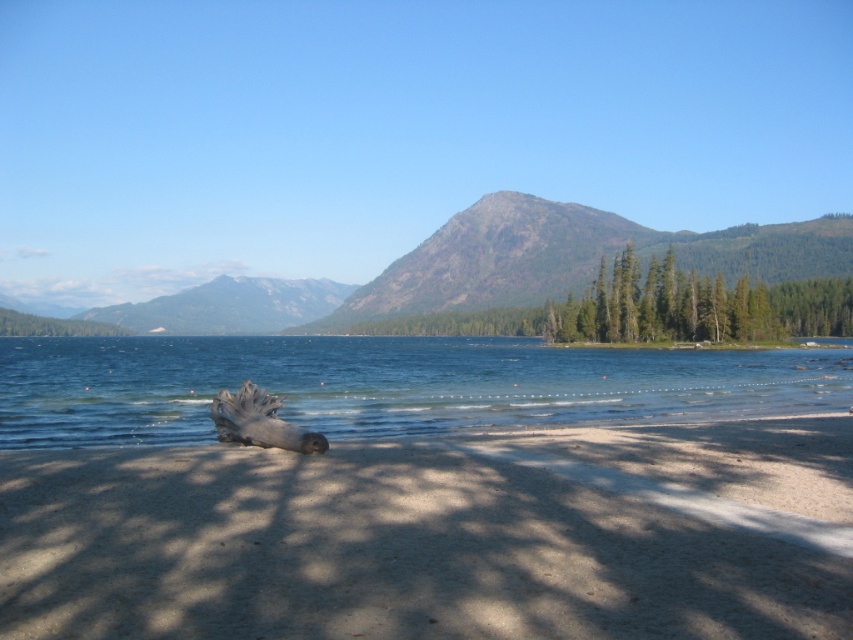
Between brown sandy beach at lower center and green textured mountain at center, which one has more height?

green textured mountain at center

Is brown sandy beach at lower center closer to camera compared to green textured mountain at center?

That is True.

Which is in front, point (795, 451) or point (252, 308)?

Positioned in front is point (795, 451).

This screenshot has width=853, height=640. Find the location of `brown sandy beach at lower center`. brown sandy beach at lower center is located at coordinates (439, 536).

Which is more to the left, green textured mountain at center or green textured trees at center?

From the viewer's perspective, green textured mountain at center appears more on the left side.

Measure the distance between green textured mountain at center and green textured trees at center.

green textured mountain at center is 89.32 feet from green textured trees at center.

The width and height of the screenshot is (853, 640). What do you see at coordinates (537, 284) in the screenshot? I see `green textured mountain at center` at bounding box center [537, 284].

Locate an element on the screen. green textured mountain at center is located at coordinates (537, 284).

Can you confirm if clear water at beach center is shorter than green textured mountain at center?

Yes.

Looking at this image, is clear water at beach center taller than green textured mountain at center?

Incorrect, clear water at beach center's height is not larger of green textured mountain at center's.

The width and height of the screenshot is (853, 640). In order to click on clear water at beach center in this screenshot , I will do `click(386, 385)`.

Identify the location of clear water at beach center. The height and width of the screenshot is (640, 853). (386, 385).